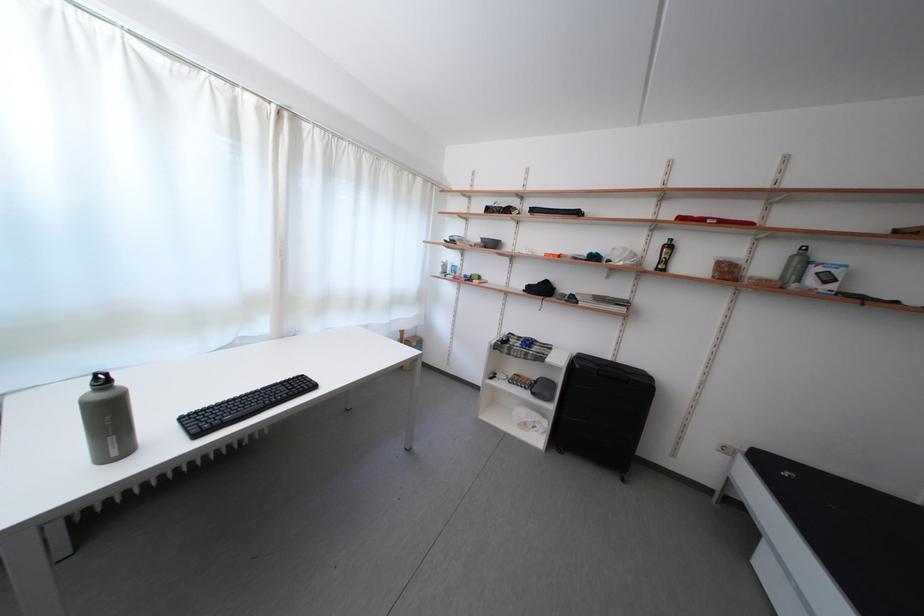
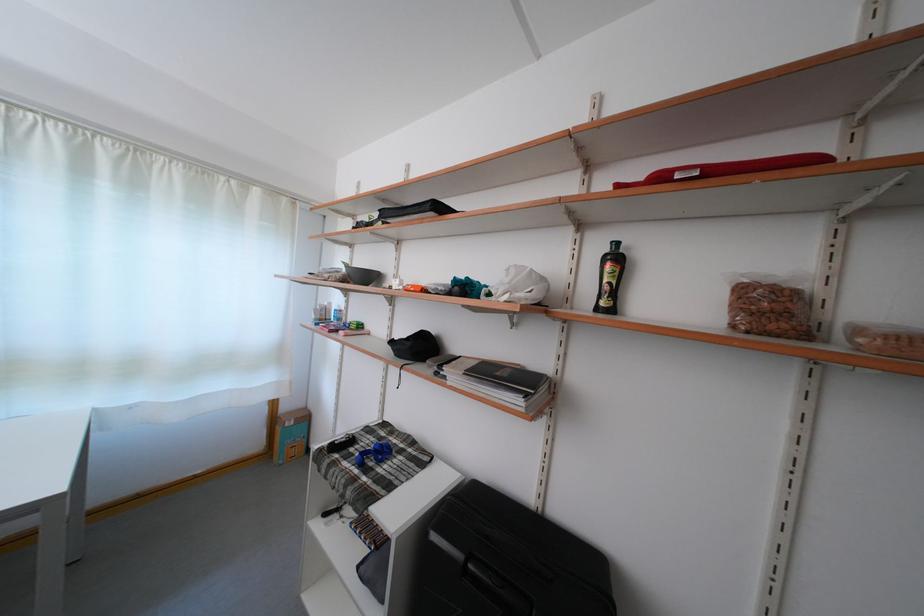
In the second image, find the point that corresponds to point (736, 278) in the first image.

(782, 321)